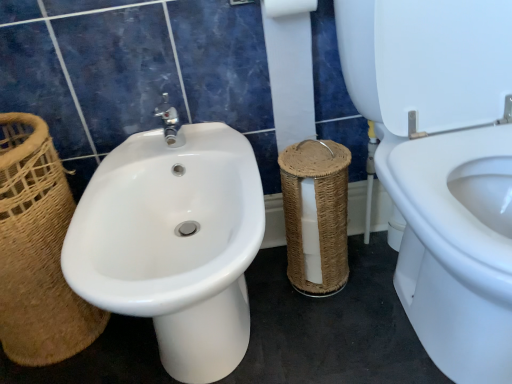
I want to click on vacant area that lies between white glossy bidet at center and woven brown basket at center, so click(317, 325).